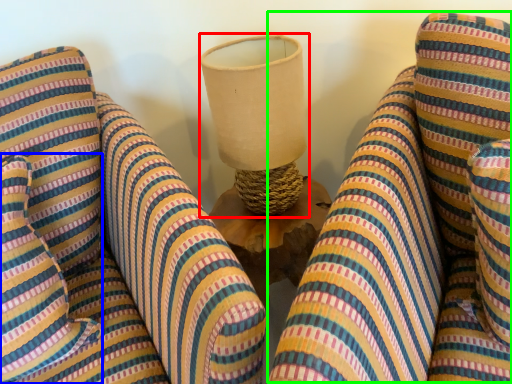
Question: Estimate the real-world distances between objects in this image. Which object is farther from table lamp (highlighted by a red box), pillow (highlighted by a blue box) or bean bag chair (highlighted by a green box)?

Choices:
 (A) pillow
 (B) bean bag chair

Answer: (A)